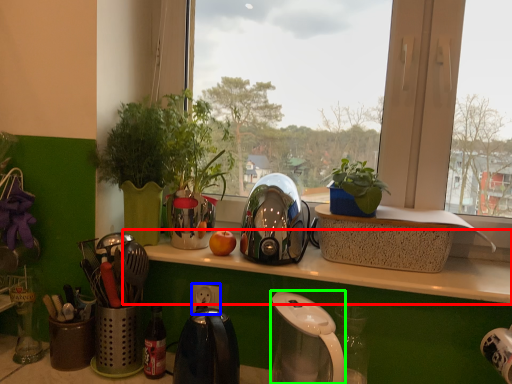
Question: Estimate the real-world distances between objects in this image. Which object is closer to window sill (highlighted by a red box), power outlet (highlighted by a blue box) or coffee maker (highlighted by a green box)?

Choices:
 (A) power outlet
 (B) coffee maker

Answer: (B)